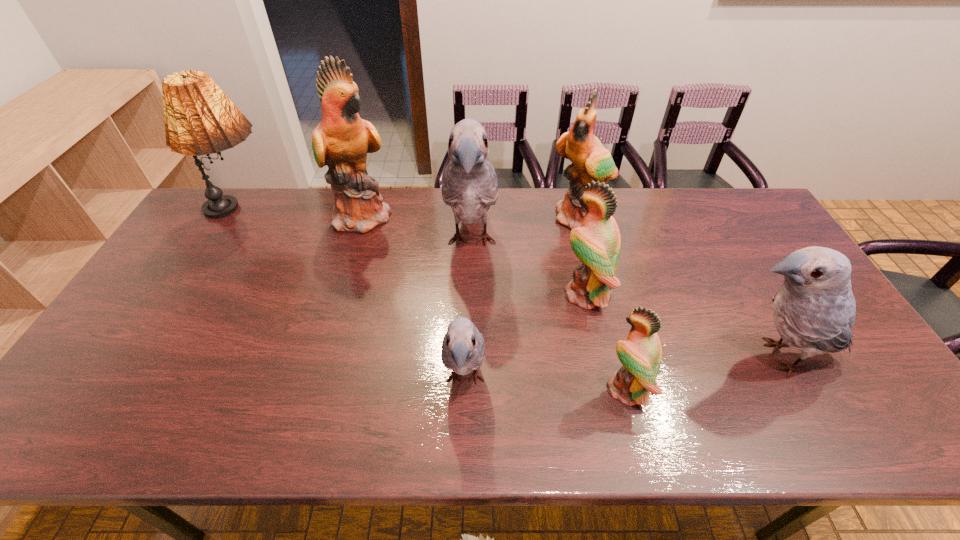
Image resolution: width=960 pixels, height=540 pixels. In order to click on vacant space at the near left corner in this screenshot , I will do (36, 444).

In the image, there is a desktop. Where is `free space at the far right corner`? This screenshot has height=540, width=960. free space at the far right corner is located at coordinates (719, 192).

At what (x,y) coordinates should I click in order to perform the action: click on vacant area that lies between the smallest gray parrot and the second nearest green parrot. Please return your answer as a coordinate pair (x, y). Image resolution: width=960 pixels, height=540 pixels. Looking at the image, I should click on (525, 337).

Image resolution: width=960 pixels, height=540 pixels. What are the coordinates of `vacant point located between the second biggest green parrot and the leftmost object` in the screenshot? It's located at (411, 217).

This screenshot has height=540, width=960. I want to click on empty location between the smallest green parrot and the leftmost object, so click(x=434, y=301).

At what (x,y) coordinates should I click in order to perform the action: click on vacant area that lies between the third smallest green parrot and the smallest gray parrot. Please return your answer as a coordinate pair (x, y). Looking at the image, I should click on (522, 299).

I want to click on vacant point located between the nearest green parrot and the rightmost object, so click(702, 373).

Where is `blank region between the smallest gray parrot and the second smallest green parrot`? blank region between the smallest gray parrot and the second smallest green parrot is located at coordinates (525, 337).

Identify the location of blank region between the leftmost object and the second smallest gray parrot. The image size is (960, 540). (509, 285).

Where is `object that is the fifth closest to the seventh object from right to left`? Image resolution: width=960 pixels, height=540 pixels. object that is the fifth closest to the seventh object from right to left is located at coordinates (597, 243).